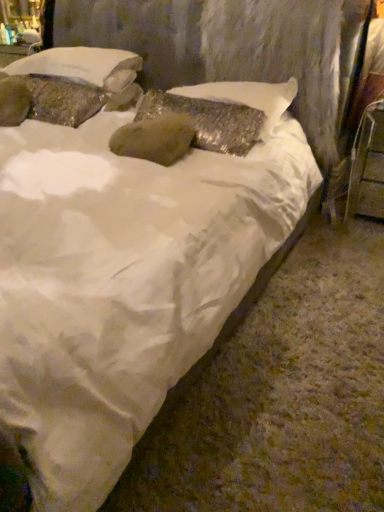
In order to face textured stone pillow at upper left, acting as the 3th pillow starting from the right, should I rotate leftwards or rightwards?

To align with it, rotate left about 19.296°.

What do you see at coordinates (48, 100) in the screenshot? I see `textured stone pillow at upper left, acting as the 3th pillow starting from the right` at bounding box center [48, 100].

Image resolution: width=384 pixels, height=512 pixels. What do you see at coordinates (248, 98) in the screenshot?
I see `shiny metallic pillow at center, placed as the 1th pillow when sorted from right to left` at bounding box center [248, 98].

Find the location of a particular element. Image resolution: width=384 pixels, height=512 pixels. metallic silver chair at right is located at coordinates (367, 166).

What do you see at coordinates (83, 65) in the screenshot? I see `textured stone pillow at upper left, arranged as the 2th pillow when viewed from the left` at bounding box center [83, 65].

Identify the location of textured stone pillow at upper left, marked as the 1th pillow in a left-to-right arrangement. Image resolution: width=384 pixels, height=512 pixels. (48, 100).

Consider the image. Is metallic silver chair at right at the back of textured stone pillow at upper left, placed as the 2th pillow when sorted from right to left?

textured stone pillow at upper left, placed as the 2th pillow when sorted from right to left, is not turned away from metallic silver chair at right.

Which object is wider, textured stone pillow at upper left, placed as the 2th pillow when sorted from right to left, or metallic silver chair at right?

With larger width is textured stone pillow at upper left, placed as the 2th pillow when sorted from right to left.

Between textured stone pillow at upper left, placed as the 2th pillow when sorted from right to left, and metallic silver chair at right, which one appears on the left side from the viewer's perspective?

textured stone pillow at upper left, placed as the 2th pillow when sorted from right to left.

Could you measure the distance between textured stone pillow at upper left, arranged as the 2th pillow when viewed from the left, and metallic silver chair at right?

textured stone pillow at upper left, arranged as the 2th pillow when viewed from the left, is 1.47 meters from metallic silver chair at right.

How different are the orientations of textured stone pillow at upper left, acting as the 3th pillow starting from the right, and metallic silver chair at right in degrees?

The angular difference between textured stone pillow at upper left, acting as the 3th pillow starting from the right, and metallic silver chair at right is 1.69 degrees.

How distant is textured stone pillow at upper left, acting as the 3th pillow starting from the right, from metallic silver chair at right?

The distance of textured stone pillow at upper left, acting as the 3th pillow starting from the right, from metallic silver chair at right is 5.20 feet.

Is textured stone pillow at upper left, marked as the 1th pillow in a left-to-right arrangement, positioned in front of metallic silver chair at right?

No, it is behind metallic silver chair at right.

This screenshot has width=384, height=512. What are the coordinates of `furniture that appears on the right of textured stone pillow at upper left, marked as the 1th pillow in a left-to-right arrangement` in the screenshot? It's located at [367, 166].

Considering the positions of point (233, 82) and point (63, 64), is point (233, 82) closer or farther from the camera than point (63, 64)?

Point (233, 82) is positioned closer to the camera compared to point (63, 64).

Is shiny metallic pillow at center, placed as the 1th pillow when sorted from right to left, turned away from textured stone pillow at upper left, placed as the 2th pillow when sorted from right to left?

No, shiny metallic pillow at center, placed as the 1th pillow when sorted from right to left,'s orientation is not away from textured stone pillow at upper left, placed as the 2th pillow when sorted from right to left.

Based on the photo, does shiny metallic pillow at center, placed as the 1th pillow when sorted from right to left, have a smaller size compared to textured stone pillow at upper left, placed as the 2th pillow when sorted from right to left?

Indeed, shiny metallic pillow at center, placed as the 1th pillow when sorted from right to left, has a smaller size compared to textured stone pillow at upper left, placed as the 2th pillow when sorted from right to left.

Can you confirm if metallic silver chair at right is thinner than textured stone pillow at upper left, marked as the 1th pillow in a left-to-right arrangement?

In fact, metallic silver chair at right might be wider than textured stone pillow at upper left, marked as the 1th pillow in a left-to-right arrangement.

In the scene shown: Between metallic silver chair at right and textured stone pillow at upper left, marked as the 1th pillow in a left-to-right arrangement, which one has smaller size?

Smaller between the two is textured stone pillow at upper left, marked as the 1th pillow in a left-to-right arrangement.

Considering the relative sizes of metallic silver chair at right and textured stone pillow at upper left, acting as the 3th pillow starting from the right, in the image provided, is metallic silver chair at right taller than textured stone pillow at upper left, acting as the 3th pillow starting from the right,?

Yes, metallic silver chair at right is taller than textured stone pillow at upper left, acting as the 3th pillow starting from the right.

In the scene shown: Is textured stone pillow at upper left, acting as the 3th pillow starting from the right, directly adjacent to shiny metallic pillow at center, placed as the third pillow when sorted from left to right?

No, textured stone pillow at upper left, acting as the 3th pillow starting from the right, is not with shiny metallic pillow at center, placed as the third pillow when sorted from left to right.

Is shiny metallic pillow at center, placed as the third pillow when sorted from left to right, at the back of textured stone pillow at upper left, marked as the 1th pillow in a left-to-right arrangement?

No, textured stone pillow at upper left, marked as the 1th pillow in a left-to-right arrangement,'s orientation is not away from shiny metallic pillow at center, placed as the third pillow when sorted from left to right.

From a real-world perspective, is textured stone pillow at upper left, marked as the 1th pillow in a left-to-right arrangement, positioned under shiny metallic pillow at center, placed as the third pillow when sorted from left to right, based on gravity?

Yes, from a real-world perspective, textured stone pillow at upper left, marked as the 1th pillow in a left-to-right arrangement, is below shiny metallic pillow at center, placed as the third pillow when sorted from left to right.

Does textured stone pillow at upper left, acting as the 3th pillow starting from the right, have a lesser width compared to shiny metallic pillow at center, placed as the third pillow when sorted from left to right?

Correct, the width of textured stone pillow at upper left, acting as the 3th pillow starting from the right, is less than that of shiny metallic pillow at center, placed as the third pillow when sorted from left to right.

Which is nearer, (354, 143) or (256, 105)?

Positioned in front is point (256, 105).

In the image, is metallic silver chair at right on the left side or the right side of shiny metallic pillow at center, placed as the third pillow when sorted from left to right?

Based on their positions, metallic silver chair at right is located to the right of shiny metallic pillow at center, placed as the third pillow when sorted from left to right.

Is metallic silver chair at right in contact with shiny metallic pillow at center, placed as the third pillow when sorted from left to right?

metallic silver chair at right and shiny metallic pillow at center, placed as the third pillow when sorted from left to right, are not in contact.

From the image's perspective, is metallic silver chair at right above or below textured stone pillow at upper left, arranged as the 2th pillow when viewed from the left?

metallic silver chair at right is below textured stone pillow at upper left, arranged as the 2th pillow when viewed from the left.

How many degrees apart are the facing directions of metallic silver chair at right and textured stone pillow at upper left, arranged as the 2th pillow when viewed from the left?

The angle between the facing direction of metallic silver chair at right and the facing direction of textured stone pillow at upper left, arranged as the 2th pillow when viewed from the left, is 0.0637 degrees.

Is metallic silver chair at right at the right side of textured stone pillow at upper left, placed as the 2th pillow when sorted from right to left?

Correct, you'll find metallic silver chair at right to the right of textured stone pillow at upper left, placed as the 2th pillow when sorted from right to left.

Is metallic silver chair at right further to camera compared to textured stone pillow at upper left, arranged as the 2th pillow when viewed from the left?

No, it is not.

Where is `the 3rd pillow above the metallic silver chair at right (from the image's perspective)`? the 3rd pillow above the metallic silver chair at right (from the image's perspective) is located at coordinates (83, 65).

From the metallic silver chair at right, count the 3rd pillow to the left and point to it. Please provide its 2D coordinates.

[(48, 100)]

Considering their positions, is metallic silver chair at right positioned further to textured stone pillow at upper left, marked as the 1th pillow in a left-to-right arrangement, than shiny metallic pillow at center, placed as the third pillow when sorted from left to right?

Among the two, metallic silver chair at right is located further to textured stone pillow at upper left, marked as the 1th pillow in a left-to-right arrangement.

Estimate the real-world distances between objects in this image. Which object is further from shiny metallic pillow at center, placed as the 1th pillow when sorted from right to left, textured stone pillow at upper left, marked as the 1th pillow in a left-to-right arrangement, or textured stone pillow at upper left, placed as the 2th pillow when sorted from right to left?

textured stone pillow at upper left, marked as the 1th pillow in a left-to-right arrangement, lies further to shiny metallic pillow at center, placed as the 1th pillow when sorted from right to left, than the other object.

From the image, which object appears to be farther from metallic silver chair at right, textured stone pillow at upper left, marked as the 1th pillow in a left-to-right arrangement, or textured stone pillow at upper left, arranged as the 2th pillow when viewed from the left?

textured stone pillow at upper left, marked as the 1th pillow in a left-to-right arrangement, is further to metallic silver chair at right.

Considering their positions, is textured stone pillow at upper left, acting as the 3th pillow starting from the right, positioned closer to shiny metallic pillow at center, placed as the 1th pillow when sorted from right to left, than metallic silver chair at right?

Among the two, metallic silver chair at right is located nearer to shiny metallic pillow at center, placed as the 1th pillow when sorted from right to left.

Looking at the image, which one is located further to textured stone pillow at upper left, arranged as the 2th pillow when viewed from the left, textured stone pillow at upper left, acting as the 3th pillow starting from the right, or metallic silver chair at right?

The object further to textured stone pillow at upper left, arranged as the 2th pillow when viewed from the left, is metallic silver chair at right.

Based on their spatial positions, is textured stone pillow at upper left, placed as the 2th pillow when sorted from right to left, or metallic silver chair at right further from textured stone pillow at upper left, acting as the 3th pillow starting from the right?

metallic silver chair at right.

Which object lies further to the anchor point textured stone pillow at upper left, marked as the 1th pillow in a left-to-right arrangement, shiny metallic pillow at center, placed as the third pillow when sorted from left to right, or textured stone pillow at upper left, placed as the 2th pillow when sorted from right to left?

The object further to textured stone pillow at upper left, marked as the 1th pillow in a left-to-right arrangement, is shiny metallic pillow at center, placed as the third pillow when sorted from left to right.

Looking at the image, which one is located closer to shiny metallic pillow at center, placed as the 1th pillow when sorted from right to left, metallic silver chair at right or textured stone pillow at upper left, placed as the 2th pillow when sorted from right to left?

textured stone pillow at upper left, placed as the 2th pillow when sorted from right to left, is closer to shiny metallic pillow at center, placed as the 1th pillow when sorted from right to left.

In order to click on pillow situated between textured stone pillow at upper left, marked as the 1th pillow in a left-to-right arrangement, and shiny metallic pillow at center, placed as the 1th pillow when sorted from right to left, from left to right in this screenshot , I will do `click(83, 65)`.

Find the location of `pillow located between textured stone pillow at upper left, arranged as the 2th pillow when viewed from the left, and metallic silver chair at right in the left-right direction`. pillow located between textured stone pillow at upper left, arranged as the 2th pillow when viewed from the left, and metallic silver chair at right in the left-right direction is located at coordinates (248, 98).